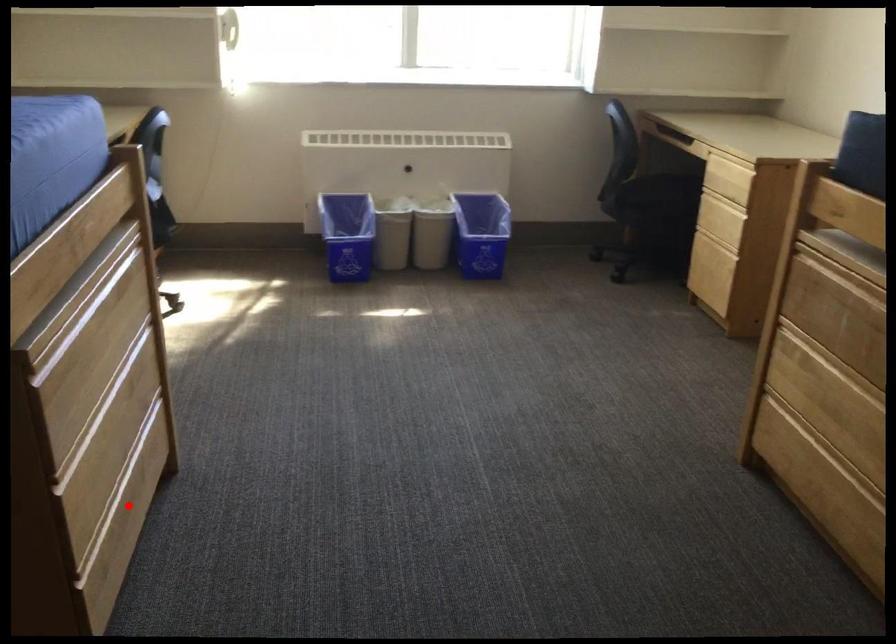
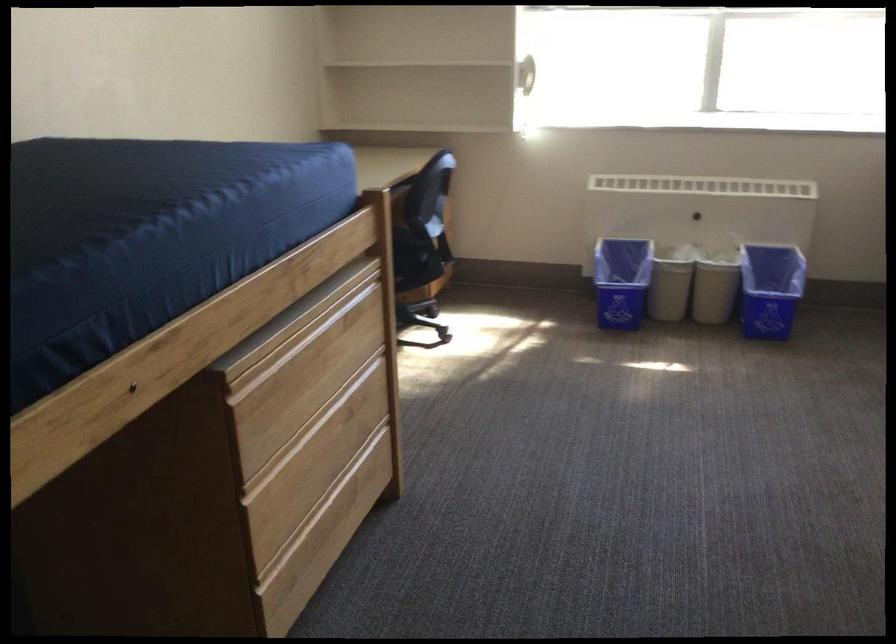
Where in the second image is the point corresponding to the highlighted location from the first image?

(330, 523)